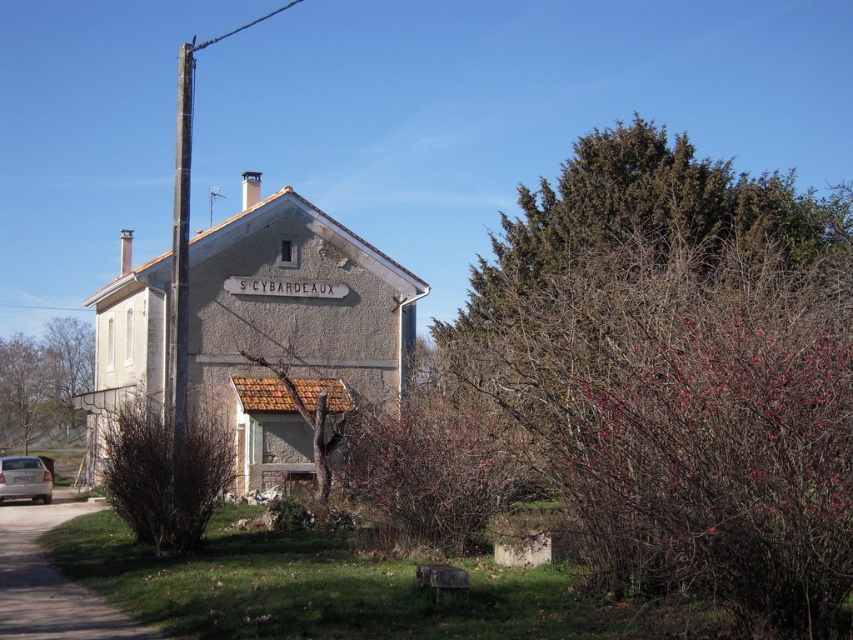
Question: Which is nearer to the white stone sign at center?

Choices:
 (A) smooth gray pole at left
 (B) silver metallic car at lower left
 (C) bare branches at left

Answer: (A)

Question: Can you confirm if smooth gray pole at left is smaller than silver metallic car at lower left?

Choices:
 (A) yes
 (B) no

Answer: (B)

Question: Which is farther from the bare branches at left?

Choices:
 (A) silver metallic car at lower left
 (B) smooth gray pole at left
 (C) white stone sign at center

Answer: (C)

Question: Does bare branches at left have a lesser width compared to smooth gray pole at left?

Choices:
 (A) no
 (B) yes

Answer: (B)

Question: Is bare branches at left positioned behind smooth gray pole at left?

Choices:
 (A) yes
 (B) no

Answer: (A)

Question: Which of the following is the closest to the observer?

Choices:
 (A) smooth gray pole at left
 (B) bare branches at left
 (C) silver metallic car at lower left
 (D) white stone sign at center

Answer: (A)